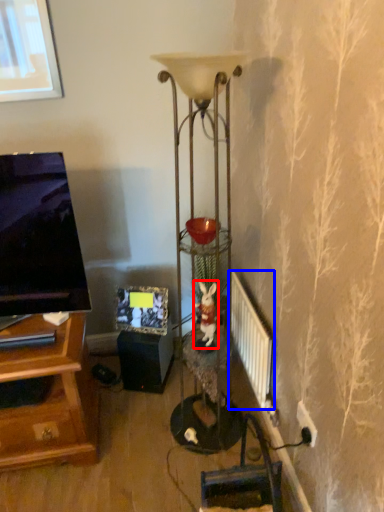
Question: Which point is further to the camera, animal (highlighted by a red box) or radiator (highlighted by a blue box)?

Choices:
 (A) animal
 (B) radiator

Answer: (A)